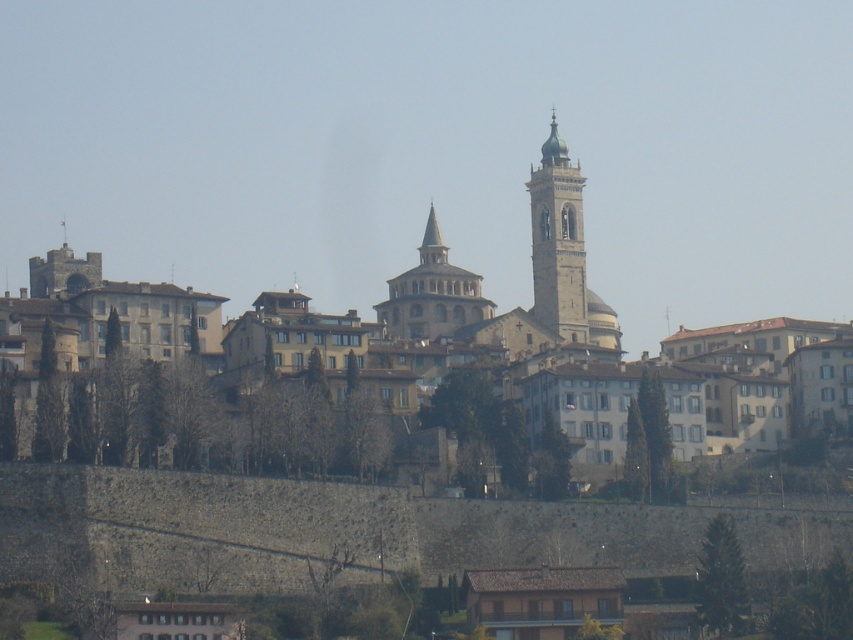
You are an architect analyzing the layout of the historic town. Given that the beige stone town at center and beige stone tower at center are both constructed from the same type of stone, which structure occupies more horizontal space in the image?

The beige stone town at center occupies more horizontal space because its width is larger than that of the beige stone tower at center.

You are standing in front of the stone wall in the foreground of the historic town. You see two towers in the center of the scene. Which tower, the beige stone tower at center or the light brown stone tower at center, is positioned to the right of the other?

The beige stone tower at center is positioned to the right of the light brown stone tower at center.

In the scene shown: You are standing in front of the stone wall in the foreground of the image. You want to walk towards the beige stone tower at center. Which direction should you walk relative to the beige stone town at center?

The beige stone town at center is located above the beige stone tower at center. To reach the beige stone tower at center, you should walk downward from the beige stone town at center.